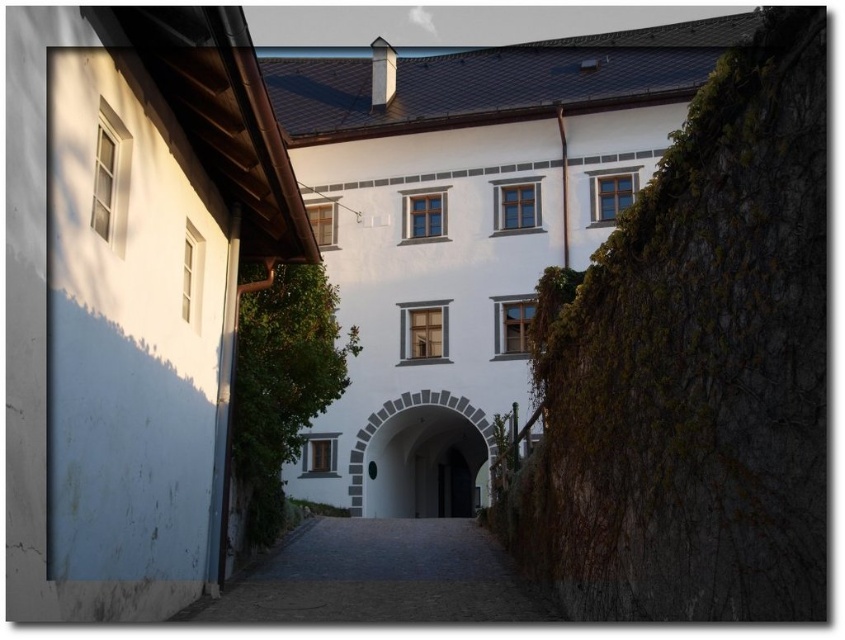
Question: Can you confirm if white stone archway at center is wider than dark wood door at center?

Choices:
 (A) no
 (B) yes

Answer: (B)

Question: Which of these objects is positioned closest to the dark wood door at center?

Choices:
 (A) dark stone path at center
 (B) white stone archway at center

Answer: (B)

Question: Among these points, which one is nearest to the camera?

Choices:
 (A) (455, 474)
 (B) (473, 620)

Answer: (B)

Question: Which of the following is the farthest from the observer?

Choices:
 (A) white stone archway at center
 (B) dark wood door at center

Answer: (B)

Question: Can you confirm if dark stone path at center is smaller than white stone archway at center?

Choices:
 (A) no
 (B) yes

Answer: (A)

Question: Can you confirm if dark stone path at center is positioned above white stone archway at center?

Choices:
 (A) no
 (B) yes

Answer: (A)